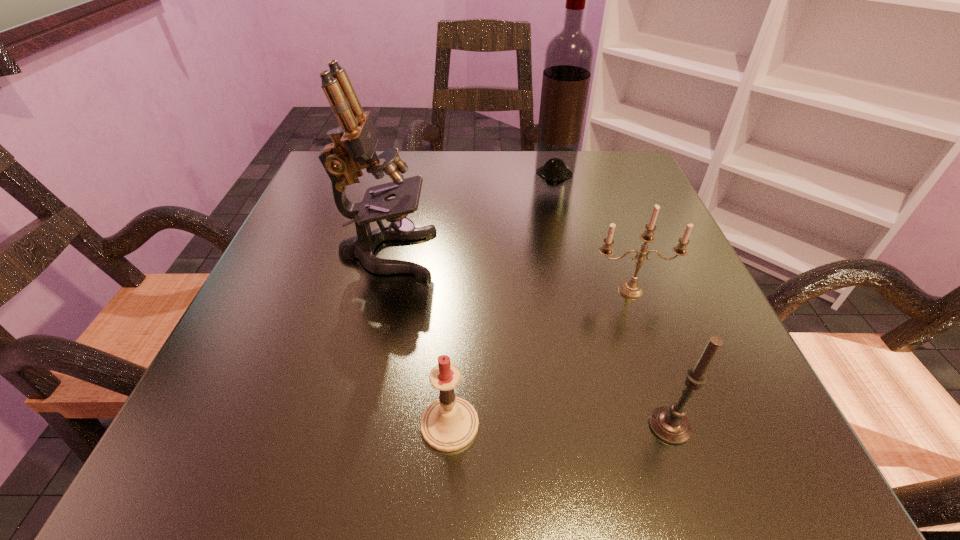
The height and width of the screenshot is (540, 960). In the image, there is a desktop. What are the coordinates of `vacant space at the far right corner` in the screenshot? It's located at (613, 173).

Image resolution: width=960 pixels, height=540 pixels. I want to click on empty space that is in between the farthest candle and the leftmost candle, so click(x=540, y=357).

Where is `unoccupied area between the shortest candle and the farthest candle`? unoccupied area between the shortest candle and the farthest candle is located at coordinates (540, 357).

Locate an element on the screen. The image size is (960, 540). vacant point located between the shortest object and the tallest object is located at coordinates (502, 299).

Identify the location of free space that is in between the third nearest object and the farthest object. (592, 232).

Image resolution: width=960 pixels, height=540 pixels. I want to click on free point between the shortest candle and the farthest candle, so click(540, 357).

Where is `vacant space that is in between the leftmost object and the third nearest object`? The image size is (960, 540). vacant space that is in between the leftmost object and the third nearest object is located at coordinates (509, 272).

Where is `object identified as the fourth closest to the farthest object`? Image resolution: width=960 pixels, height=540 pixels. object identified as the fourth closest to the farthest object is located at coordinates (448, 424).

Identify the location of object identified as the third closest to the fourth shortest object. (569, 55).

Select which candle appears as the closest to the wine bottle. Please provide its 2D coordinates. Your answer should be formatted as a tuple, i.e. [(x, y)], where the tuple contains the x and y coordinates of a point satisfying the conditions above.

[(630, 289)]